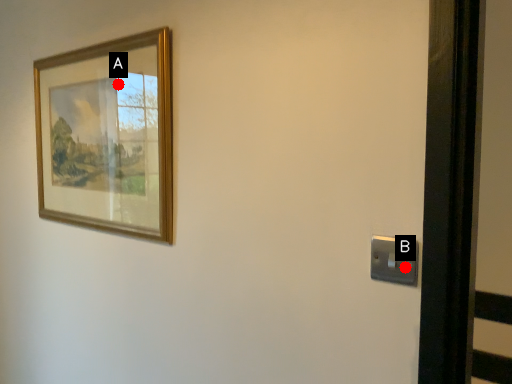
Question: Two points are circled on the image, labeled by A and B beside each circle. Which point is further to the camera?

Choices:
 (A) A is further
 (B) B is further

Answer: (A)